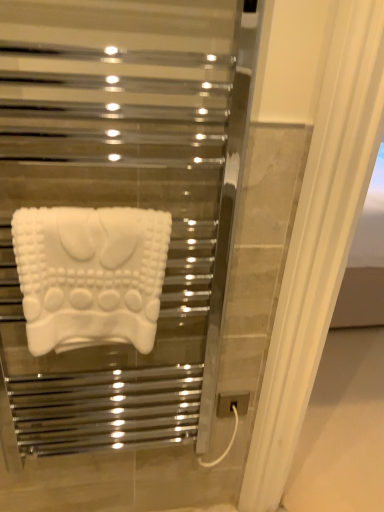
Question: Should I look upward or downward to see white matte towel at center?

Choices:
 (A) up
 (B) down

Answer: (B)

Question: Can you confirm if gray matte electric outlet at lower right is thinner than white matte towel at center?

Choices:
 (A) yes
 (B) no

Answer: (A)

Question: Is gray matte electric outlet at lower right outside of white matte towel at center?

Choices:
 (A) yes
 (B) no

Answer: (A)

Question: From the image's perspective, is gray matte electric outlet at lower right on top of white matte towel at center?

Choices:
 (A) no
 (B) yes

Answer: (A)

Question: Is the position of gray matte electric outlet at lower right less distant than that of white matte towel at center?

Choices:
 (A) no
 (B) yes

Answer: (A)

Question: From a real-world perspective, is gray matte electric outlet at lower right on white matte towel at center?

Choices:
 (A) no
 (B) yes

Answer: (A)

Question: Is white matte towel at center at the back of gray matte electric outlet at lower right?

Choices:
 (A) no
 (B) yes

Answer: (A)

Question: Is white matte towel at center positioned beyond the bounds of gray matte electric outlet at lower right?

Choices:
 (A) yes
 (B) no

Answer: (A)

Question: Can you confirm if white matte towel at center is shorter than gray matte electric outlet at lower right?

Choices:
 (A) yes
 (B) no

Answer: (B)

Question: Is gray matte electric outlet at lower right inside white matte towel at center?

Choices:
 (A) yes
 (B) no

Answer: (B)

Question: From a real-world perspective, is white matte towel at center physically below gray matte electric outlet at lower right?

Choices:
 (A) no
 (B) yes

Answer: (A)

Question: Could you tell me if white matte towel at center is turned towards gray matte electric outlet at lower right?

Choices:
 (A) no
 (B) yes

Answer: (A)

Question: Can you confirm if white matte towel at center is bigger than gray matte electric outlet at lower right?

Choices:
 (A) no
 (B) yes

Answer: (B)

Question: In terms of width, does white matte towel at center look wider or thinner when compared to gray matte electric outlet at lower right?

Choices:
 (A) thin
 (B) wide

Answer: (B)